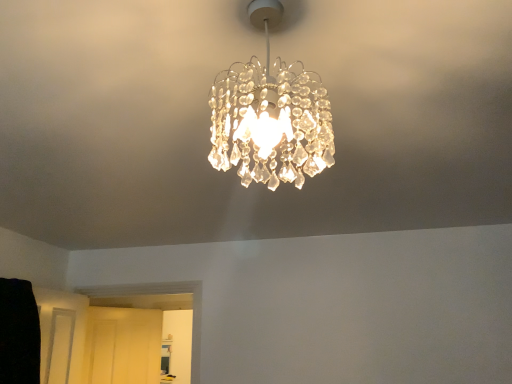
Question: Is clear crystal chandelier at center turned away from matte white door at lower left?

Choices:
 (A) yes
 (B) no

Answer: (B)

Question: Is clear crystal chandelier at center positioned in front of matte white door at lower left?

Choices:
 (A) no
 (B) yes

Answer: (B)

Question: Considering the relative sizes of clear crystal chandelier at center and matte white door at lower left in the image provided, is clear crystal chandelier at center thinner than matte white door at lower left?

Choices:
 (A) no
 (B) yes

Answer: (A)

Question: Considering the relative sizes of clear crystal chandelier at center and matte white door at lower left in the image provided, is clear crystal chandelier at center bigger than matte white door at lower left?

Choices:
 (A) yes
 (B) no

Answer: (B)

Question: From a real-world perspective, is clear crystal chandelier at center on top of matte white door at lower left?

Choices:
 (A) yes
 (B) no

Answer: (A)

Question: Would you say clear crystal chandelier at center is outside matte white door at lower left?

Choices:
 (A) no
 (B) yes

Answer: (B)

Question: Does matte white door at lower left have a greater width compared to clear crystal chandelier at center?

Choices:
 (A) yes
 (B) no

Answer: (B)

Question: Is matte white door at lower left closer to the viewer compared to clear crystal chandelier at center?

Choices:
 (A) no
 (B) yes

Answer: (A)

Question: Is matte white door at lower left smaller than clear crystal chandelier at center?

Choices:
 (A) no
 (B) yes

Answer: (A)

Question: From a real-world perspective, is matte white door at lower left physically above clear crystal chandelier at center?

Choices:
 (A) yes
 (B) no

Answer: (B)

Question: Would you say clear crystal chandelier at center is part of matte white door at lower left's contents?

Choices:
 (A) no
 (B) yes

Answer: (A)

Question: Does matte white door at lower left have a lesser width compared to clear crystal chandelier at center?

Choices:
 (A) no
 (B) yes

Answer: (B)

Question: Is matte white door at lower left to the left or to the right of clear crystal chandelier at center in the image?

Choices:
 (A) right
 (B) left

Answer: (B)